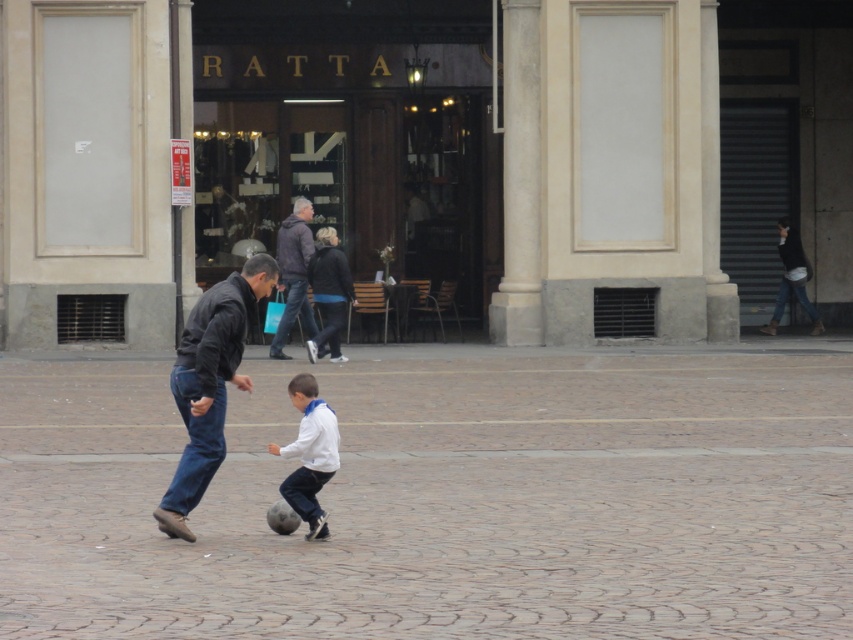
You are a photographer trying to capture a candid shot of the two people at the center of the image. You notice the dark blue jeans at center and the white matte shirt at center. Which clothing item would you focus on to ensure both subjects are in frame without cropping?

The dark blue jeans at center has a larger width than the white matte shirt at center, so focusing on the dark blue jeans at center would ensure both subjects are in frame without cropping.

You are a photographer trying to capture a candid shot of the two people playing soccer in the square. You want to ensure both the white matte shirt at center and the dark brown leather jacket at center are clearly visible in the frame. Based on their positions, which one is closer to the camera?

The white matte shirt at center is positioned under the dark brown leather jacket at center, meaning the dark brown leather jacket at center is closer to the camera.

Based on the photo, you are a photographer planning to capture a group photo of the two people in the scene. The camera you are using has a maximum width capacity of 1.5 meters. Given the information about their clothing, can both individuals wearing the white matte shirt at center and dark brown leather jacket at center fit within the camera frame without any part of them being cut off?

The white matte shirt at center is narrower than the dark brown leather jacket at center. Since the camera has a maximum width capacity of 1.5 meters, and the combined width of both individuals would depend on their positions. However, since the white matte shirt at center is narrower, it is possible that both can fit within the frame if positioned appropriately, but exact dimensions are not provided.